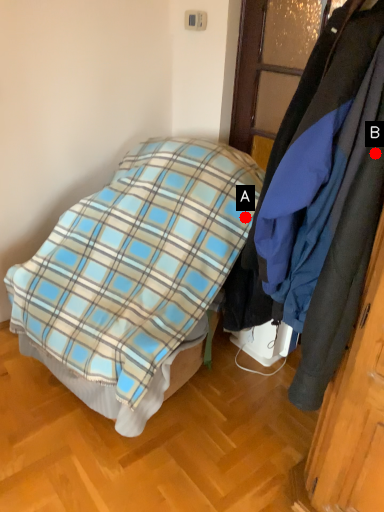
Question: Two points are circled on the image, labeled by A and B beside each circle. Which point appears farthest from the camera in this image?

Choices:
 (A) A is further
 (B) B is further

Answer: (A)